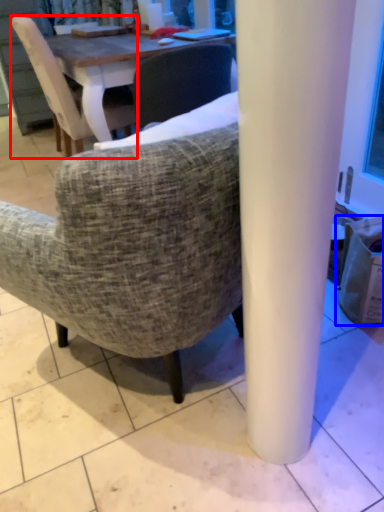
Question: Among these objects, which one is farthest to the camera, chair (highlighted by a red box) or trash bin/can (highlighted by a blue box)?

Choices:
 (A) chair
 (B) trash bin/can

Answer: (A)